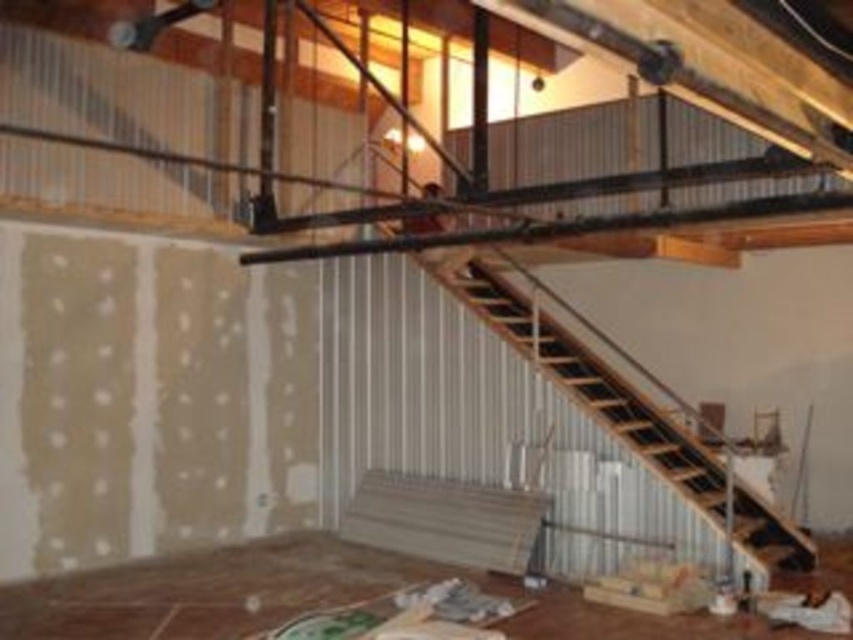
You are a construction worker standing on the wooden floor at lower left and need to reach the upper level. Which object must you step onto first to ascend the wooden stairs at center?

You must first step onto the wooden stairs at center because they are positioned behind the wooden floor at lower left, meaning they are elevated and accessible from there.

You are a contractor assessing the construction site. You need to determine which area has more space available for storage between the wooden floor at lower left and the wooden stairs at center. According to the scene, which area would you recommend?

The wooden stairs at center occupy more space than the wooden floor at lower left, so the wooden stairs at center would have more space available for storage.

You are a worker standing on the wooden floor at lower left. You need to reach the upper level by climbing the wooden stairs at center. Which direction should you move to approach the stairs?

The wooden floor at lower left is positioned under the wooden stairs at center, so you should move upwards towards the wooden stairs at center to reach the upper level.